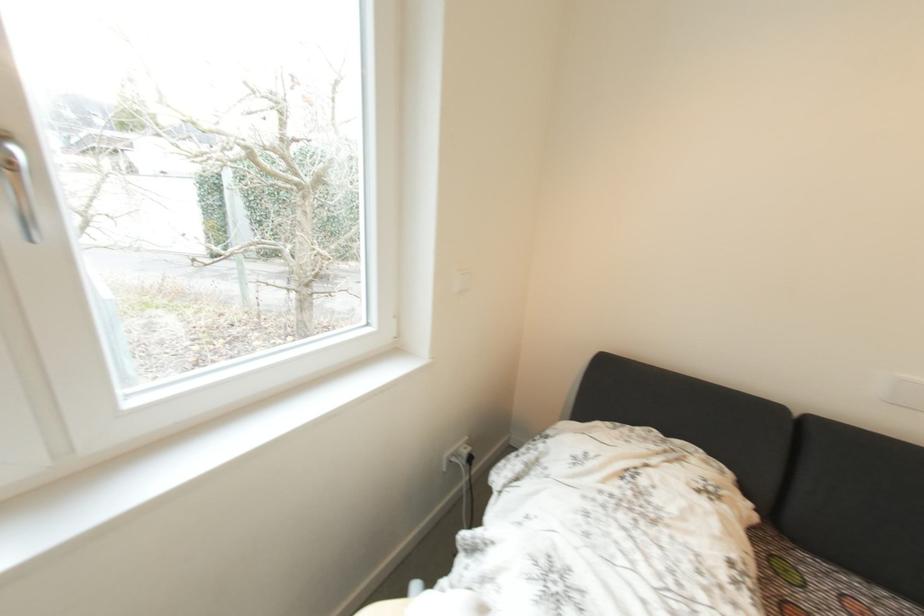
Image resolution: width=924 pixels, height=616 pixels. I want to click on sofa sitting surface, so click(x=815, y=583).